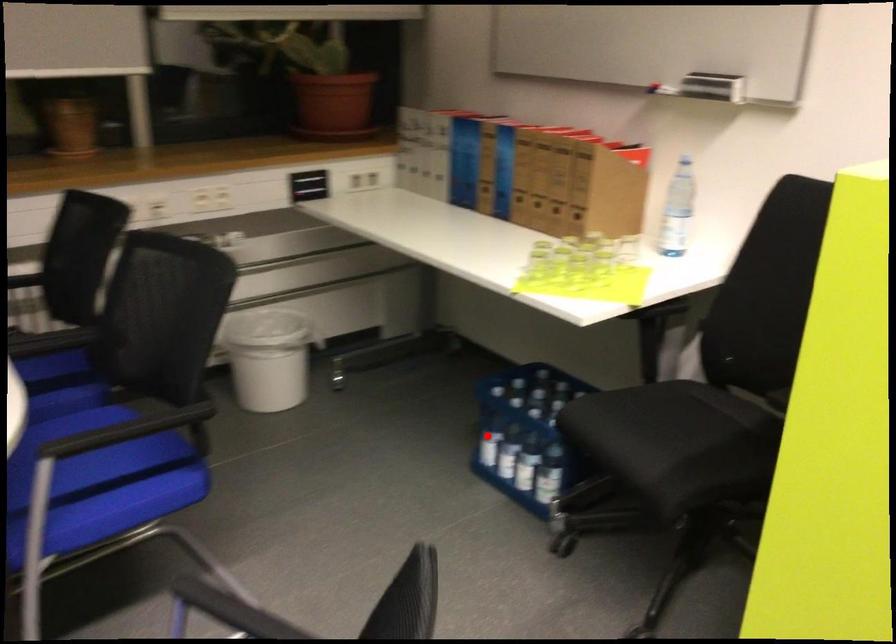
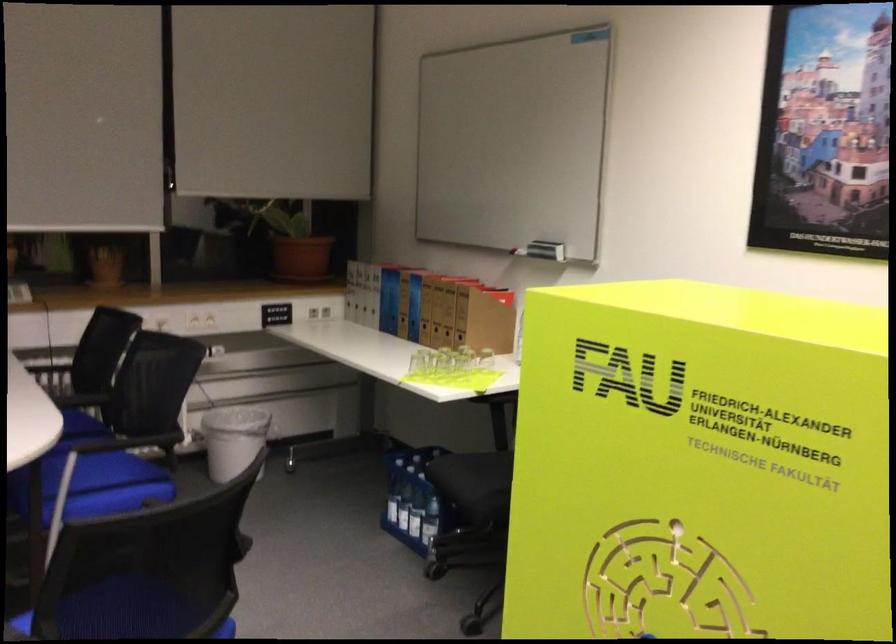
Question: A red point is marked in image1. In image2, is the corresponding 3D point closer to the camera or farther? Reply with the corresponding letter.

Choices:
 (A) The corresponding 3D point is closer.
 (B) The corresponding 3D point is farther.

Answer: (B)